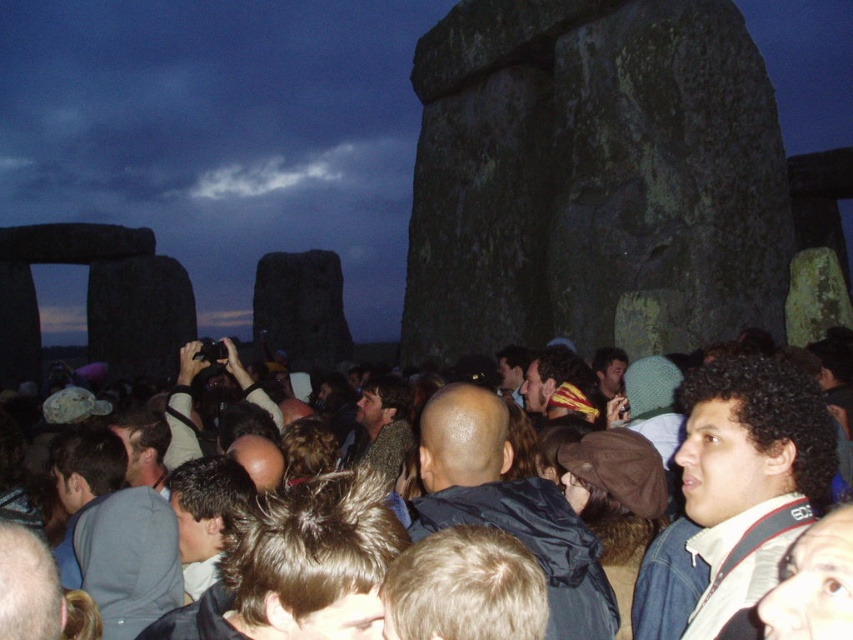
Does point (685, 97) come closer to viewer compared to point (299, 406)?

That is True.

The height and width of the screenshot is (640, 853). Find the location of `dark gray stone at center`. dark gray stone at center is located at coordinates (593, 177).